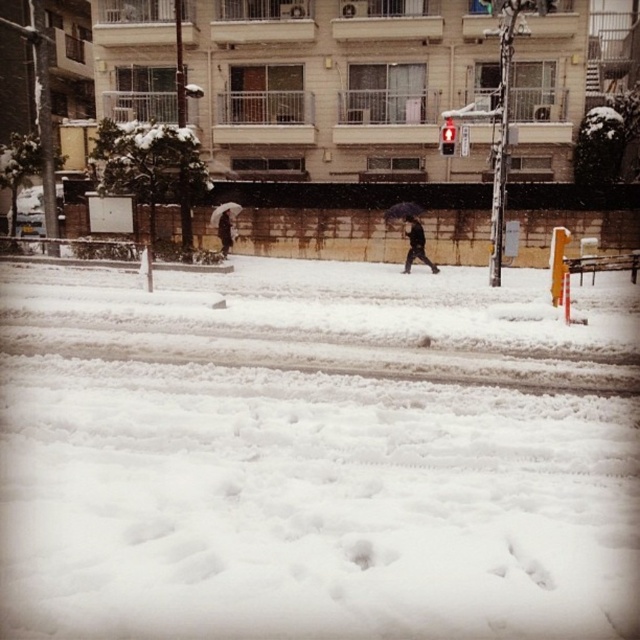
Question: Which of the following is the closest to the observer?

Choices:
 (A) dark brown leather jacket at center
 (B) black matte umbrella at center
 (C) dark gray fabric umbrella at center

Answer: (A)

Question: Which point is farther from the camera taking this photo?

Choices:
 (A) (413, 252)
 (B) (508, 394)
 (C) (417, 205)

Answer: (C)

Question: Estimate the real-world distances between objects in this image. Which object is farther from the black matte umbrella at center?

Choices:
 (A) white fluffy snow at center
 (B) white matte umbrella at center

Answer: (A)

Question: Where is white fluffy snow at center located in relation to dark brown leather jacket at center in the image?

Choices:
 (A) below
 (B) above

Answer: (A)

Question: Is dark brown leather jacket at center above dark gray fabric umbrella at center?

Choices:
 (A) yes
 (B) no

Answer: (B)

Question: Does black matte umbrella at center have a smaller size compared to white matte umbrella at center?

Choices:
 (A) no
 (B) yes

Answer: (B)